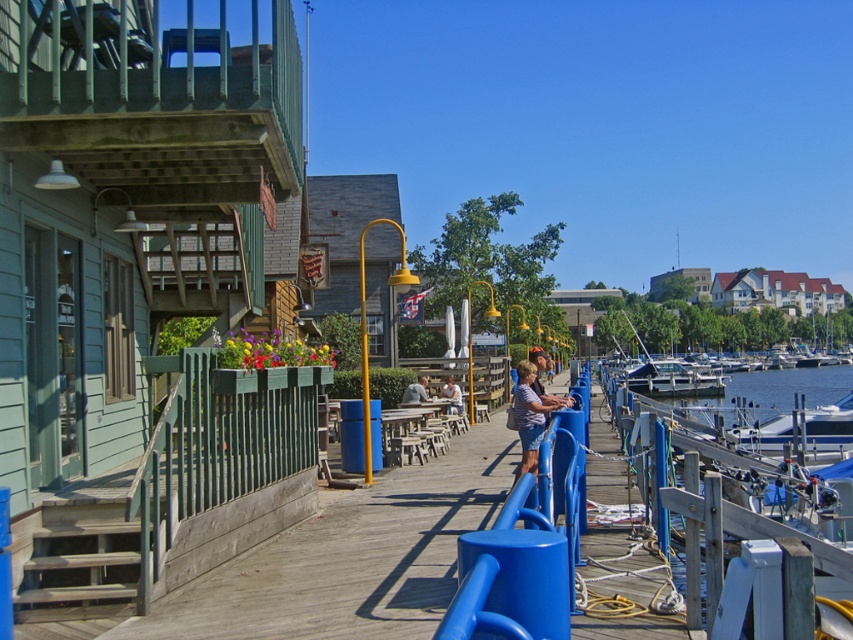
You are a photographer planning to take a photo of the white fiberglass boat at right and the blue denim shorts at right. Since you want to ensure both subjects are in focus, you need to know which one is closer to the camera. Can you determine which object is nearer to the camera based on their sizes?

The white fiberglass boat at right is taller than the blue denim shorts at right, so the blue denim shorts at right must be closer to the camera since objects closer to the camera appear larger in the image.

You are standing on the boardwalk and want to take a photo of the white glossy boat at right without the light blue shirt at center blocking the view. Is the boat visible from your current position?

The white glossy boat at right is below the light blue shirt at center, so the boat is positioned lower than the shirt. Since you are standing at the same level as the shirt, the boat should be visible below it unless the shirt wearer is directly in front of the boat. However, the description doesn

You are a photographer standing on the boardwalk and want to capture both the white fiberglass boat at right and the blue denim shorts at right in the same frame. Which object should you position closer to the edge of your camera frame to ensure both fit horizontally?

Since the white fiberglass boat at right is wider than the blue denim shorts at right, you should position the white fiberglass boat at right closer to the edge of your camera frame to ensure both fit horizontally.